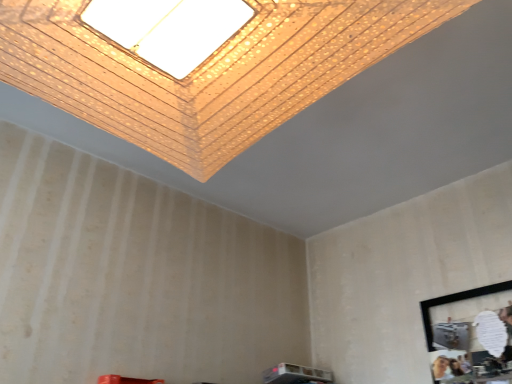
Describe the element at coordinates (207, 70) in the screenshot. This screenshot has height=384, width=512. I see `matte glass lampshade at upper center` at that location.

Identify the location of matte glass lampshade at upper center. The height and width of the screenshot is (384, 512). coord(207,70).

This screenshot has width=512, height=384. I want to click on matte glass lampshade at upper center, so click(x=207, y=70).